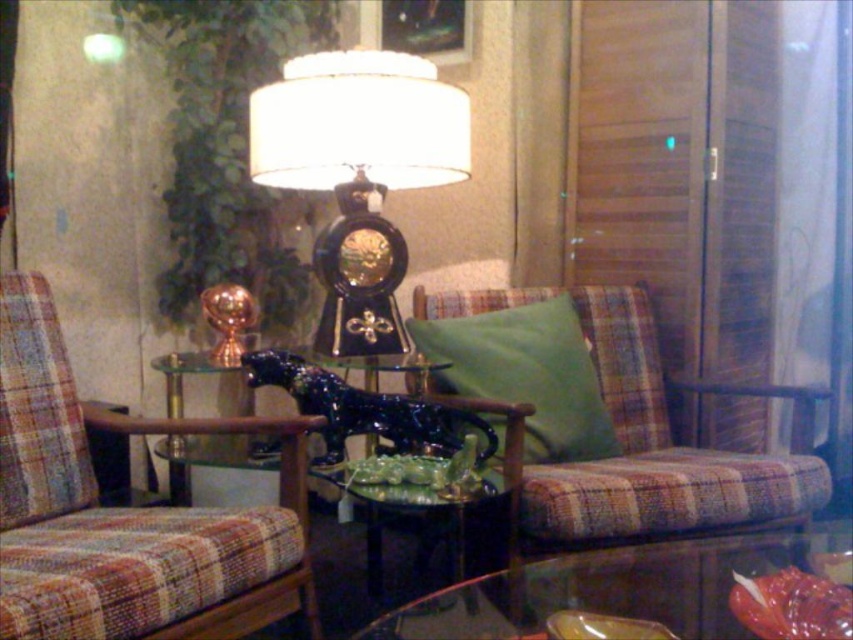
Question: Is plaid fabric couch at center below shiny dark blue statue at center?

Choices:
 (A) yes
 (B) no

Answer: (A)

Question: Considering the real-world distances, which object is closest to the transparent glass table at lower center?

Choices:
 (A) plaid fabric chair at left
 (B) green fabric pillow at center

Answer: (A)

Question: Is plaid fabric chair at left positioned before green glossy side table at center?

Choices:
 (A) no
 (B) yes

Answer: (B)

Question: Among these points, which one is nearest to the camera?

Choices:
 (A) (79, 468)
 (B) (421, 492)
 (C) (374, 136)
 (D) (793, 540)

Answer: (D)

Question: Which object is farther from the camera taking this photo?

Choices:
 (A) green fabric pillow at center
 (B) transparent glass table at lower center
 (C) black glass clock at center
 (D) green glossy side table at center

Answer: (A)

Question: Is black glass clock at center to the left of transparent glass table at lower center from the viewer's perspective?

Choices:
 (A) no
 (B) yes

Answer: (B)